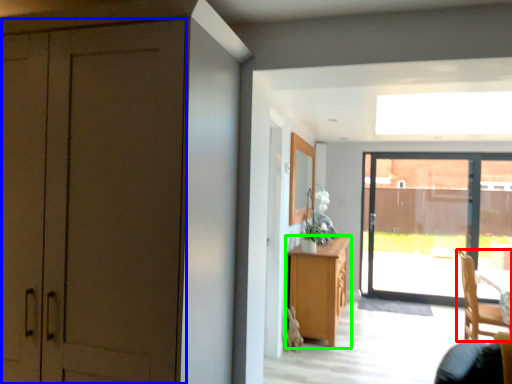
Question: Based on their relative distances, which object is farther from chair (highlighted by a red box)? Choose from door (highlighted by a blue box) and cabinetry (highlighted by a green box).

Choices:
 (A) door
 (B) cabinetry

Answer: (A)